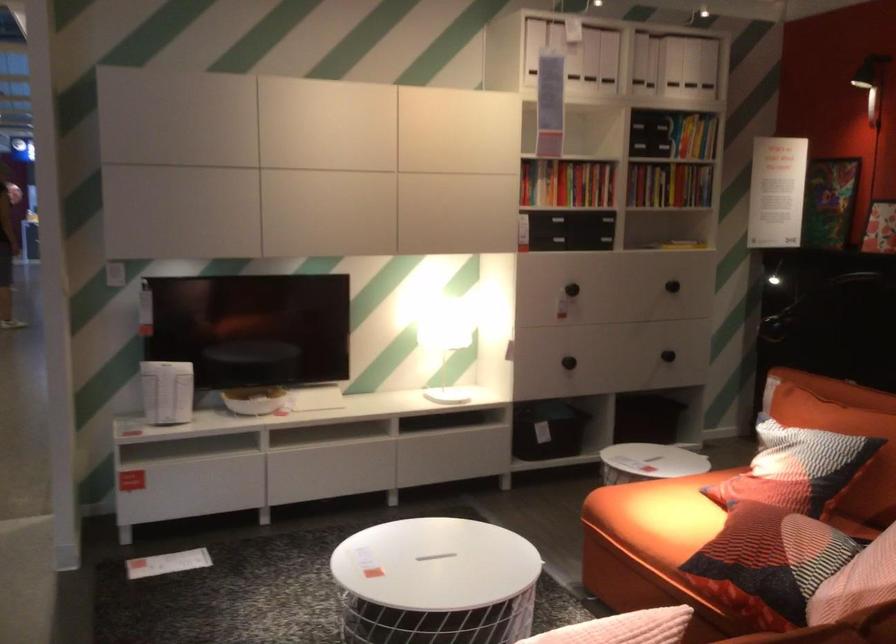
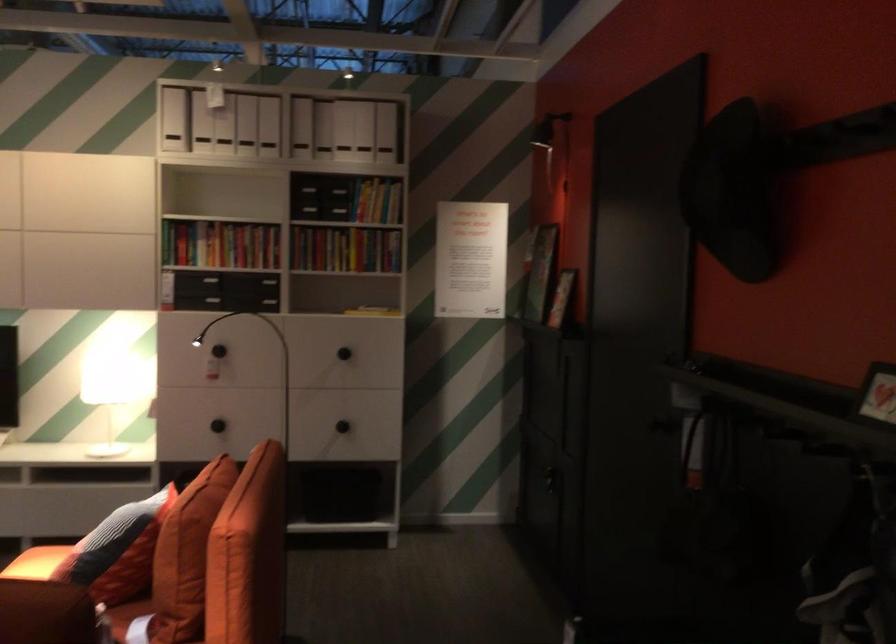
Locate, in the second image, the point that corresponds to pixel 705 265 in the first image.

(343, 353)